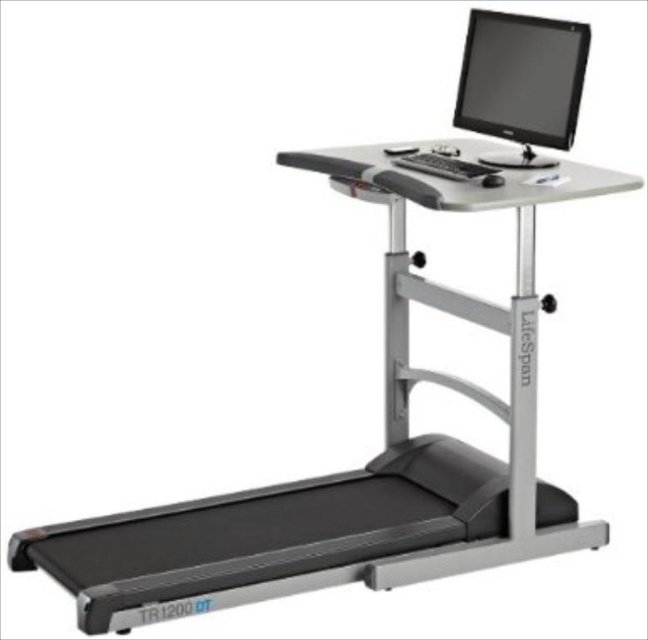
You are setting up a LifeSpan TR1200 DT treadmill desk and need to place the black glossy monitor at upper center and the black plastic mouse at upper center on the desk. Which object has a larger width?

The black glossy monitor at upper center has a larger width than the black plastic mouse at upper center according to the description.

You are setting up a treadmill desk and want to ensure your hands can comfortably reach both the black matte keyboard at upper center and the black plastic mouse at upper center while walking. Based on their positions, which one is farther away from you?

The black plastic mouse at upper center is farther away because it is positioned behind the black matte keyboard at upper center.

You are standing in front of the LifeSpan TR1200 DT treadmill desk. There are two points marked on the desk surface. The first point is at coordinates point (405, 150) and the second point is at point (500, 177). Which point is closer to you?

Point (405, 150) is closer to you because it is further to the viewer than point (500, 177).